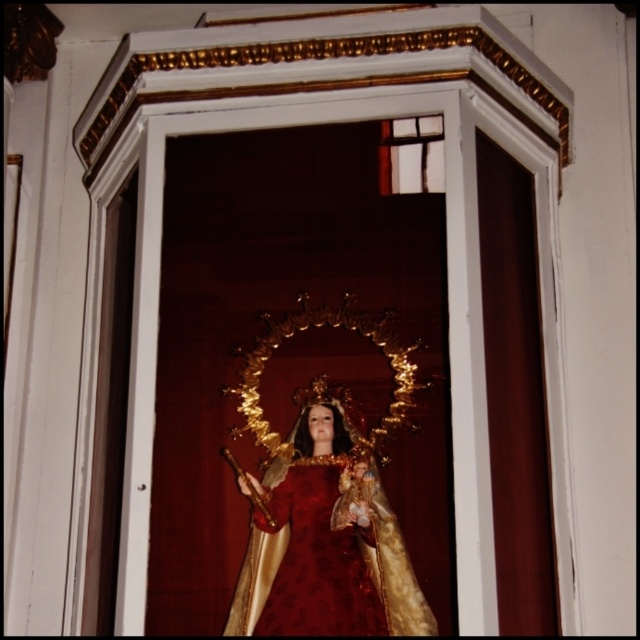
Looking at this image, you are an interior designer planning to place a new decorative item in the alcove where the velvet gold statue at center and the velvet rich red dress at center are located. The new item must be placed between them. Considering their sizes, which object should the new item be closer to?

The velvet gold statue at center is larger in size than the velvet rich red dress at center, so the new item should be placed closer to the velvet rich red dress at center to maintain balance in the alcove.

You are an art restorer examining the religious statue and its dress. You need to determine the order of the velvet gold statue at center and the velvet rich red dress at center from top to bottom. Which one is positioned higher?

The velvet gold statue at center is located above the velvet rich red dress at center, so it is positioned higher.